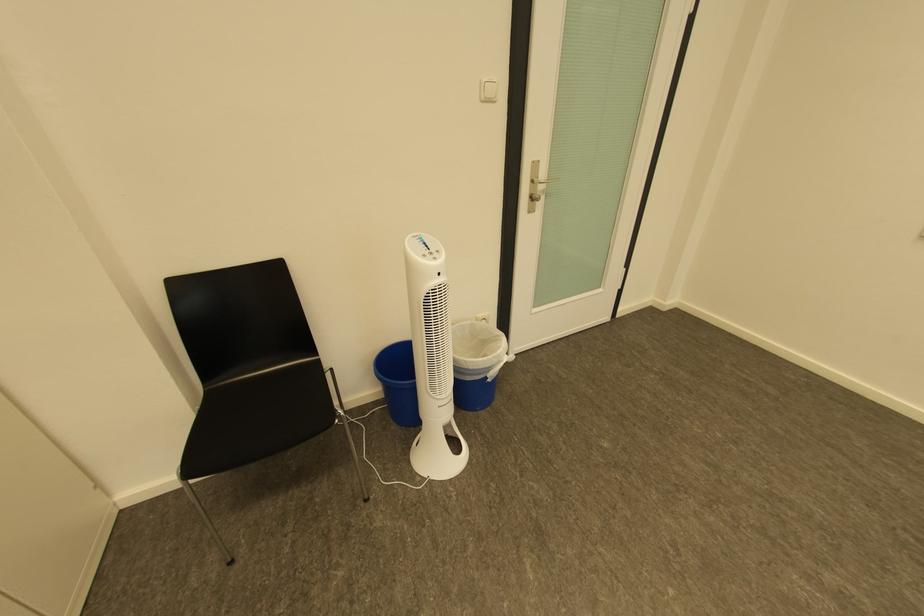
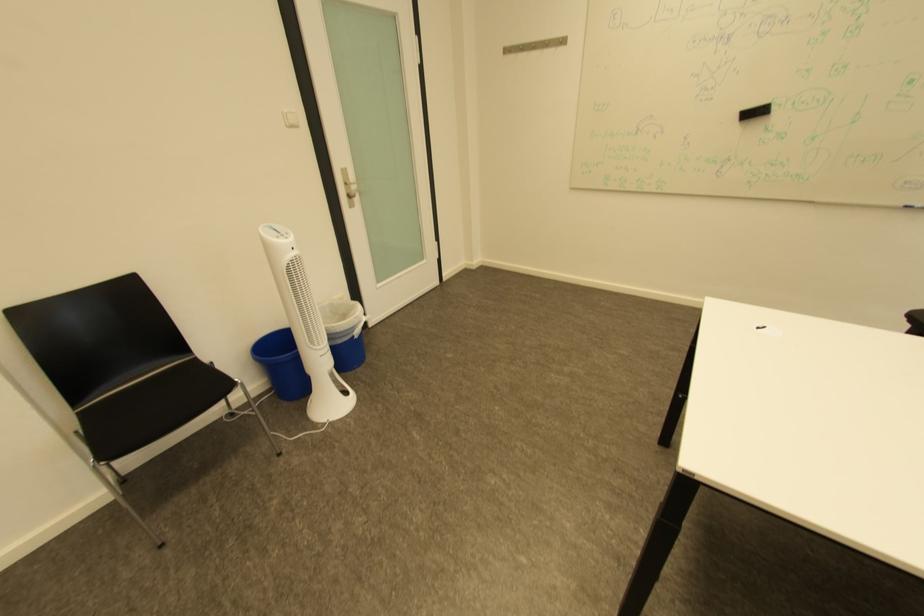
Question: The first image is from the beginning of the video and the second image is from the end. How did the camera likely rotate when shooting the video?

Choices:
 (A) Left
 (B) Right
 (C) Up
 (D) Down

Answer: (B)